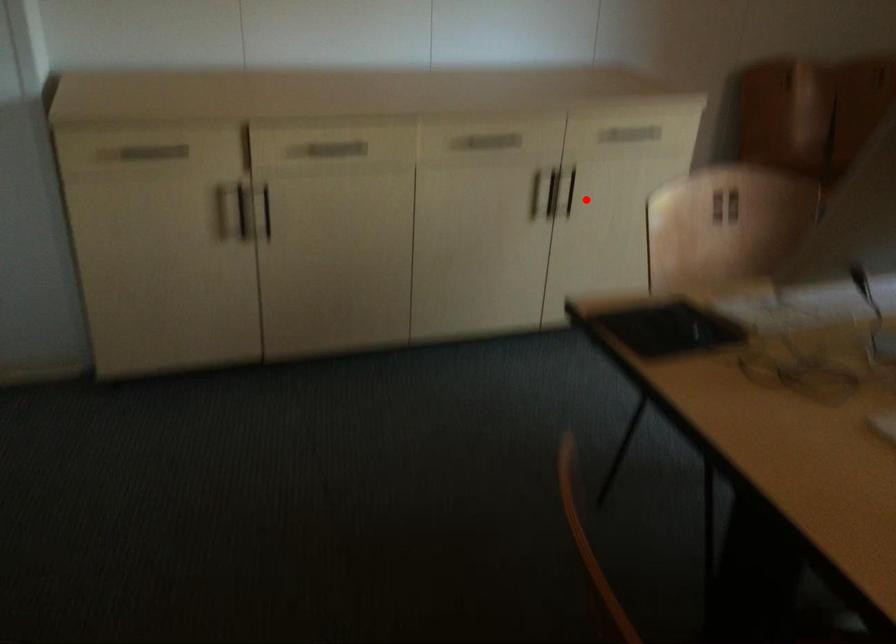
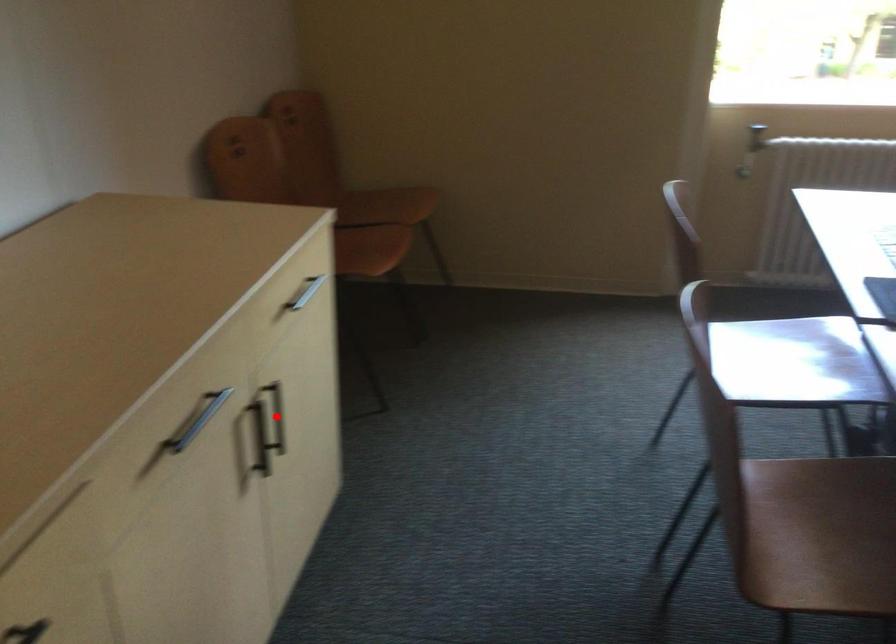
I am providing you with two images of the same scene from different viewpoints. A red point is marked on the first image and another point is marked on the second image. Is the red point in image1 aligned with the point shown in image2?

Yes